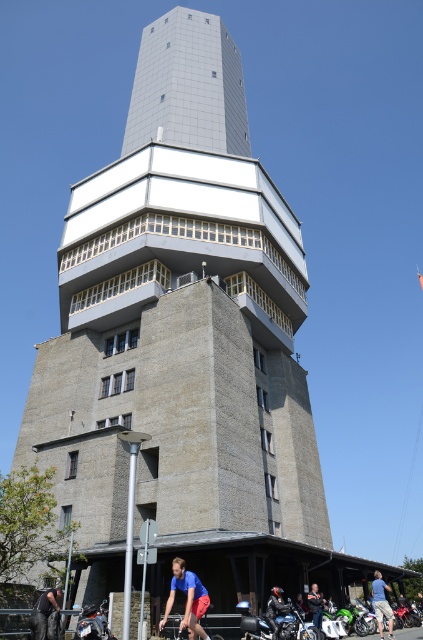
Question: Does matte blue shorts at lower center appear on the right side of shiny black motorcycle at lower center?

Choices:
 (A) yes
 (B) no

Answer: (B)

Question: Which point is closer to the camera?

Choices:
 (A) (200, 276)
 (B) (33, 632)
 (C) (175, 612)

Answer: (B)

Question: Where is shiny chrome motorcycle at lower left located in relation to leather jacket at lower center in the image?

Choices:
 (A) right
 (B) left

Answer: (B)

Question: Which point appears farthest from the camera in this image?

Choices:
 (A) (176, 573)
 (B) (381, 621)
 (C) (315, 628)

Answer: (B)

Question: Which of these objects is positioned closest to the shiny chrome motorcycle at lower center?

Choices:
 (A) blue denim shorts at lower right
 (B) matte blue shorts at lower center

Answer: (A)

Question: Is shiny chrome motorcycle at lower center smaller than dark gray jeans at lower left?

Choices:
 (A) yes
 (B) no

Answer: (B)